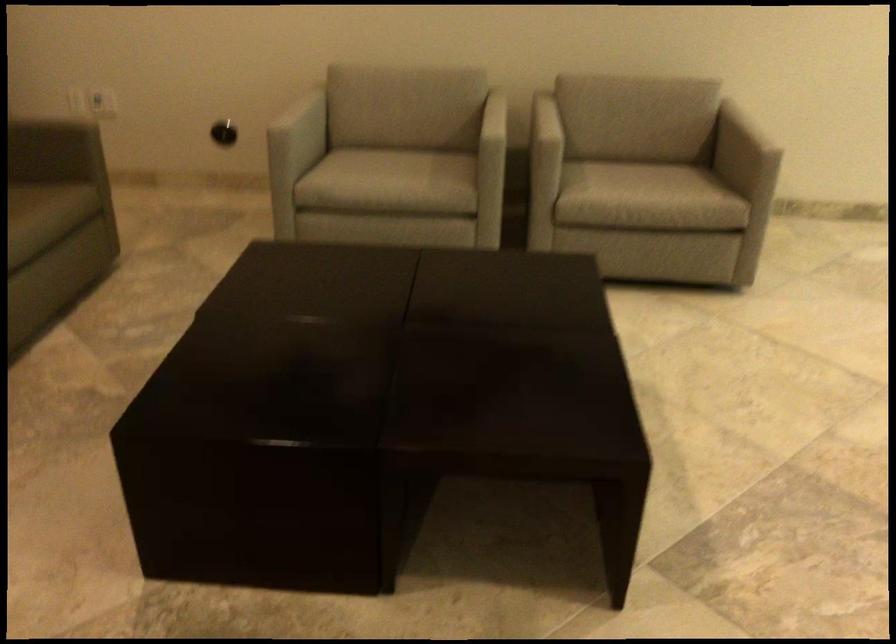
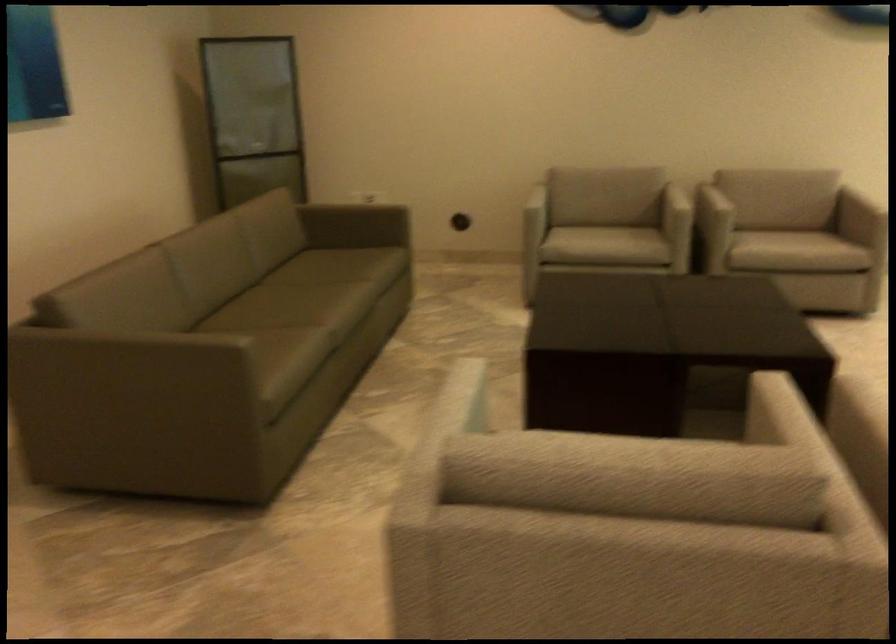
The point at (492, 151) is marked in the first image. Where is the corresponding point in the second image?

(681, 214)